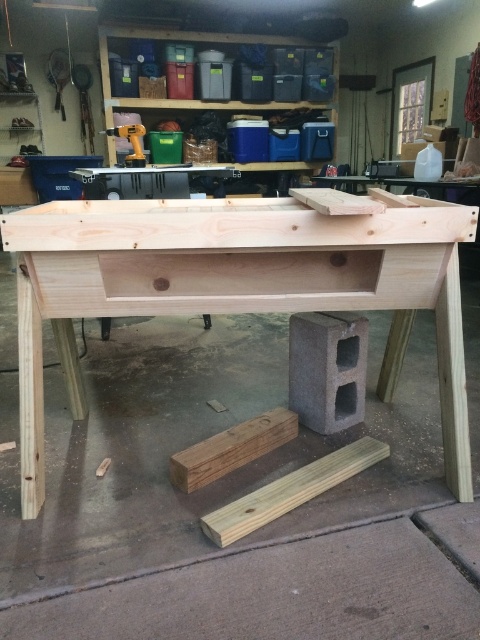
Which of these two, natural wood table at center or light brown wood plank at lower center, stands shorter?

light brown wood plank at lower center

Between natural wood table at center and light brown wood plank at lower center, which one appears on the right side from the viewer's perspective?

Positioned to the right is light brown wood plank at lower center.

Describe the element at coordinates (236, 285) in the screenshot. This screenshot has height=640, width=480. I see `natural wood table at center` at that location.

Locate an element on the screen. The image size is (480, 640). natural wood table at center is located at coordinates (236, 285).

Between natural wood plank at center and metallic yellow drill at upper center, which one is positioned higher?

metallic yellow drill at upper center is above.

The width and height of the screenshot is (480, 640). In order to click on natural wood plank at center in this screenshot , I will do coord(231,449).

Does natural wood table at center appear over metallic yellow drill at upper center?

No.

Can you confirm if natural wood table at center is positioned below metallic yellow drill at upper center?

Yes.

Describe the element at coordinates (236, 285) in the screenshot. The width and height of the screenshot is (480, 640). I see `natural wood table at center` at that location.

Where is `natural wood table at center`? Image resolution: width=480 pixels, height=640 pixels. natural wood table at center is located at coordinates (236, 285).